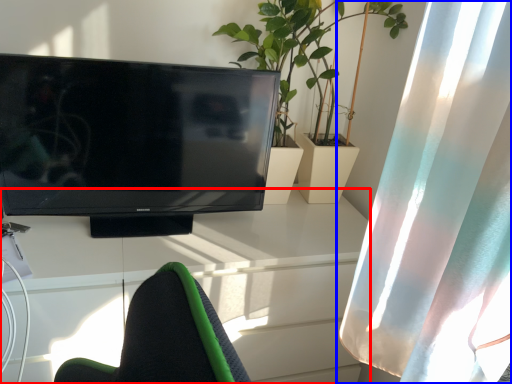
Question: Which object appears closest to the camera in this image, desk (highlighted by a red box) or curtain (highlighted by a blue box)?

Choices:
 (A) desk
 (B) curtain

Answer: (B)